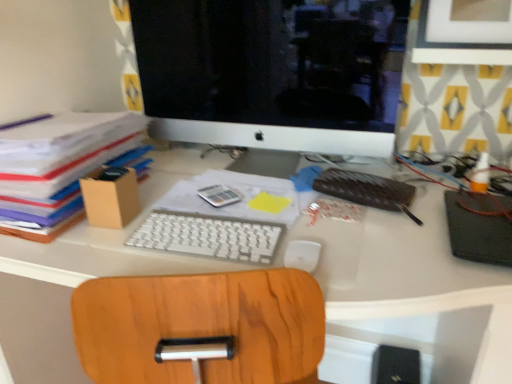
Question: Can you see leather-bound notebook at center-right, the 1th notebook in the left-to-right sequence, touching white plastic keyboard at center?

Choices:
 (A) yes
 (B) no

Answer: (B)

Question: Is leather-bound notebook at center-right, the second notebook from the right, outside of white plastic keyboard at center?

Choices:
 (A) yes
 (B) no

Answer: (A)

Question: Does leather-bound notebook at center-right, the 1th notebook in the left-to-right sequence, have a larger size compared to white plastic keyboard at center?

Choices:
 (A) no
 (B) yes

Answer: (A)

Question: Can you confirm if leather-bound notebook at center-right, the second notebook from the right, is wider than white plastic keyboard at center?

Choices:
 (A) yes
 (B) no

Answer: (B)

Question: Is leather-bound notebook at center-right, the second notebook from the right, smaller than white plastic keyboard at center?

Choices:
 (A) yes
 (B) no

Answer: (A)

Question: Looking at their shapes, would you say white plastic keyboard at center is wider or thinner than white matte mouse at center?

Choices:
 (A) wide
 (B) thin

Answer: (A)

Question: From a real-world perspective, is white plastic keyboard at center above or below white matte mouse at center?

Choices:
 (A) above
 (B) below

Answer: (B)

Question: From the image's perspective, is white plastic keyboard at center above or below white matte mouse at center?

Choices:
 (A) above
 (B) below

Answer: (B)

Question: Is point (489, 302) closer or farther from the camera than point (287, 248)?

Choices:
 (A) farther
 (B) closer

Answer: (B)

Question: Based on their positions, is leather-bound notebook at center-right, the 1th notebook in the left-to-right sequence, located to the left or right of white glossy computer monitor at upper center?

Choices:
 (A) right
 (B) left

Answer: (A)

Question: Is leather-bound notebook at center-right, the second notebook from the right, spatially inside white glossy computer monitor at upper center, or outside of it?

Choices:
 (A) outside
 (B) inside

Answer: (A)

Question: Considering their positions, is leather-bound notebook at center-right, the 1th notebook in the left-to-right sequence, located in front of or behind white glossy computer monitor at upper center?

Choices:
 (A) front
 (B) behind

Answer: (B)

Question: In terms of height, does leather-bound notebook at center-right, the 1th notebook in the left-to-right sequence, look taller or shorter compared to white glossy computer monitor at upper center?

Choices:
 (A) short
 (B) tall

Answer: (A)

Question: Looking at their shapes, would you say white plastic keyboard at center is wider or thinner than black matte notebook at right, which ranks as the second notebook in left-to-right order?

Choices:
 (A) wide
 (B) thin

Answer: (B)

Question: From the image's perspective, is white plastic keyboard at center above or below black matte notebook at right, acting as the 1th notebook starting from the right?

Choices:
 (A) above
 (B) below

Answer: (A)